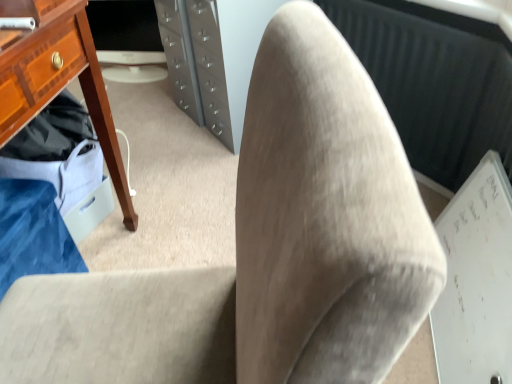
The height and width of the screenshot is (384, 512). I want to click on matte black monitor at upper left, so click(127, 40).

The width and height of the screenshot is (512, 384). What do you see at coordinates (127, 40) in the screenshot?
I see `matte black monitor at upper left` at bounding box center [127, 40].

What is the approximate height of matte black monitor at upper left?

The height of matte black monitor at upper left is 46.51 centimeters.

Locate an element on the screen. This screenshot has height=384, width=512. matte black monitor at upper left is located at coordinates (127, 40).